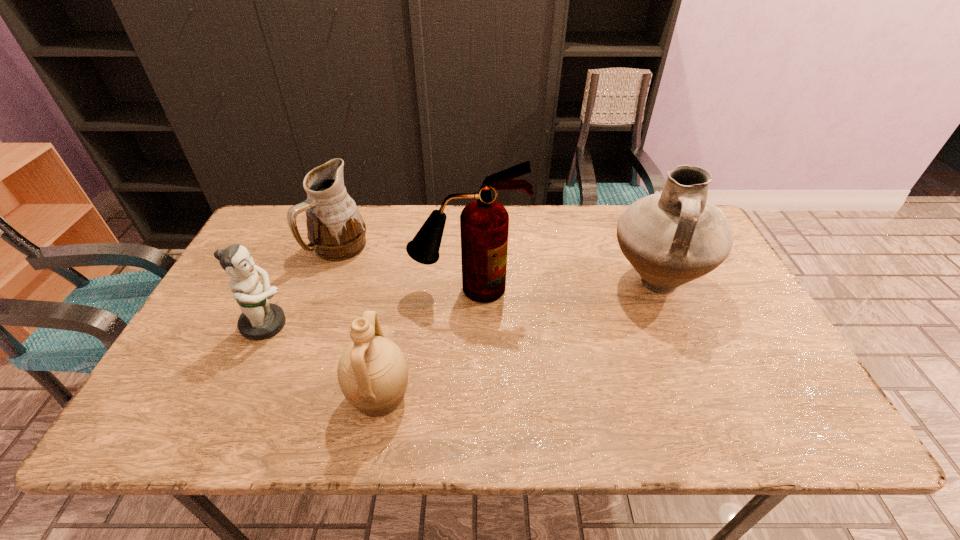
At what (x,y) coordinates should I click in order to perform the action: click on fire extinguisher. Please return your answer as a coordinate pair (x, y). The height and width of the screenshot is (540, 960). Looking at the image, I should click on (484, 223).

Identify the location of the rightmost pitcher. The height and width of the screenshot is (540, 960). (671, 238).

Image resolution: width=960 pixels, height=540 pixels. In order to click on the tallest pitcher in this screenshot , I will do `click(671, 238)`.

You are a GUI agent. You are given a task and a screenshot of the screen. Output one action in this format:
    pyautogui.click(x=<x>, y=<y>)
    Task: Click on the leftmost pitcher
    This screenshot has height=540, width=960.
    Given the screenshot: What is the action you would take?
    pyautogui.click(x=336, y=231)

Identify the location of figurine. This screenshot has width=960, height=540. (259, 320).

Image resolution: width=960 pixels, height=540 pixels. What are the coordinates of `the nearest pitcher` in the screenshot? It's located at (372, 372).

At what (x,y) coordinates should I click in order to perform the action: click on the nearest object. Please return your answer as a coordinate pair (x, y). Looking at the image, I should click on (372, 372).

The height and width of the screenshot is (540, 960). What are the coordinates of `free space located 0.250m at the nozzle of the fire extinguisher` in the screenshot? It's located at (466, 383).

Find the location of a particular element. vacant space positioned 0.150m on the handle side of the rightmost pitcher is located at coordinates (690, 367).

I want to click on vacant region located 0.170m from the spout of the leftmost pitcher, so click(x=316, y=313).